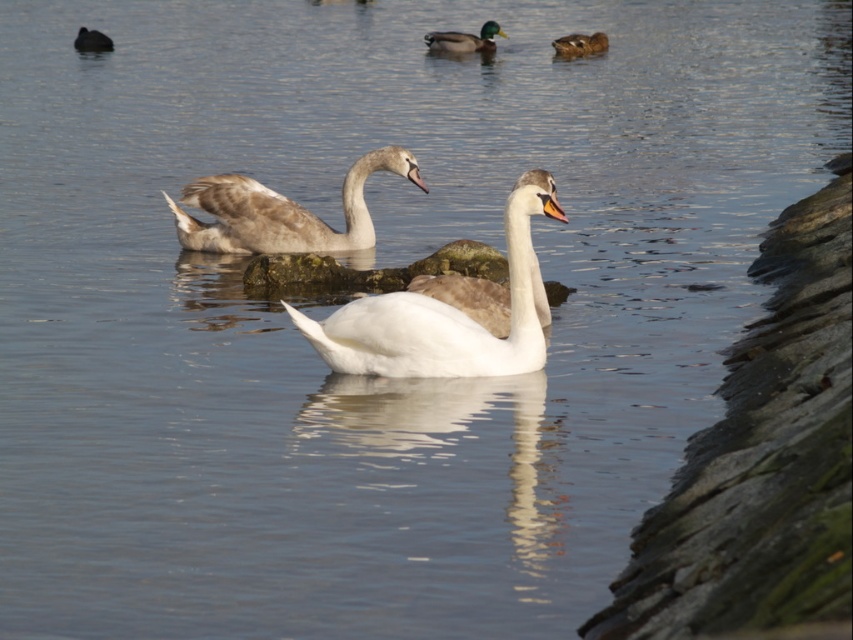
Consider the image. You are a wildlife photographer aiming to capture the green glossy duck at upper center and the brown glossy duck at upper center in a single frame. Based on their widths, which duck would appear larger in your photo?

The green glossy duck at upper center would appear larger in the photo because its width surpasses that of the brown glossy duck at upper center.

You are standing at the edge of the water and see the green glossy duck at upper center. If you want to throw a pebble to hit the duck, which direction should you aim? The coordinates are given as a normalized 0 to 1 scale where 0 is the bottom left corner of the image. Please answer with the direction in terms of left, right, up, or down relative to the duck.

The green glossy duck at upper center is located at coordinates approximately 6.2 percent from the left edge and 54.6 percent from the bottom edge. To aim accurately, you should consider the duck is positioned slightly to the upper left quadrant of the image. Since the coordinate system starts at the bottom left, aiming towards the duck would require throwing the pebble towards the upper left direction relative to your position at the water edge.

Based on the photo, you are a birdwatcher observing the scene. You notice the green glossy duck at upper center and the dark gray matte duck at upper left. Which duck is wider according to the description?

The green glossy duck at upper center might be wider than dark gray matte duck at upper left according to the description.